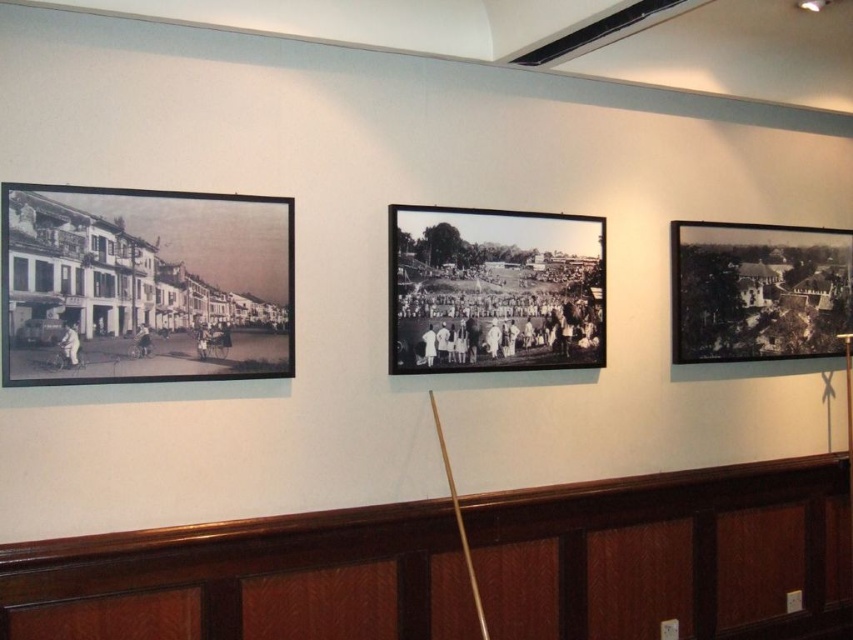
Question: Which object appears closest to the camera in this image?

Choices:
 (A) black paper at center
 (B) black paper at right

Answer: (A)

Question: From the image, what is the correct spatial relationship of black paper at left in relation to black paper at right?

Choices:
 (A) right
 (B) left

Answer: (B)

Question: Considering the real-world distances, which object is farthest from the black paper at center?

Choices:
 (A) black paper at left
 (B) black paper at right

Answer: (B)

Question: Among these points, which one is nearest to the camera?

Choices:
 (A) (540, 360)
 (B) (718, 292)
 (C) (122, 243)

Answer: (C)

Question: Can you confirm if black paper at left is positioned below black paper at right?

Choices:
 (A) no
 (B) yes

Answer: (B)

Question: Where is black paper at left located in relation to black paper at right in the image?

Choices:
 (A) left
 (B) right

Answer: (A)